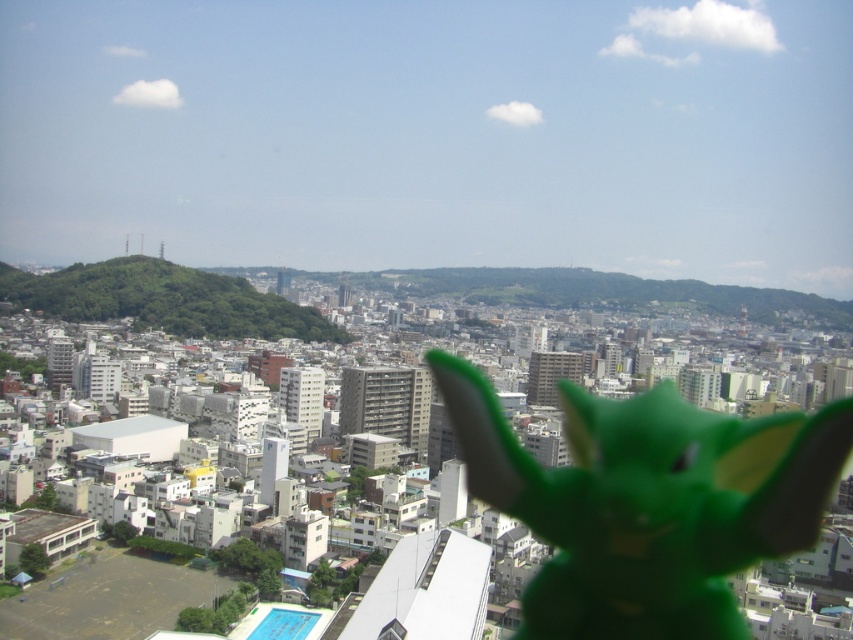
You are a city planner looking at this image. You need to place a new park in the city. The green matte toy at center and the green matte hill at center are both potential locations. Which location is to the left of the other?

The green matte hill at center is to the left of the green matte toy at center because the green matte toy at center is positioned on the right side of the green matte hill at center.

You are a photographer who wants to capture a clear shot of the green matte hill at center without the green matte toy at center blocking the view. What should you do?

The green matte toy at center is closer to the viewer than the green matte hill at center, so you should move the green matte toy at center out of the way to capture a clear shot of the green matte hill at center.

You are a city planner evaluating the layout of this urban area. You notice the green matte toy at center and the green matte hill at center. Which of these two elements takes up more space in the scene?

The green matte hill at center takes up more space than the green matte toy at center because the green matte toy at center occupies less space than green matte hill at center.